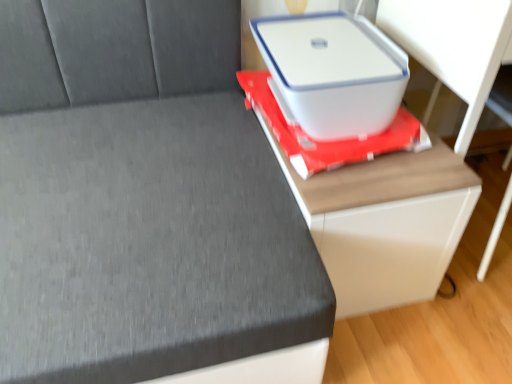
This screenshot has width=512, height=384. I want to click on white plastic storage box at upper right, so click(333, 72).

Does white plastic storage box at upper right have a greater height compared to white glossy table at center?

No.

Between white plastic storage box at upper right and white glossy table at center, which one appears on the right side from the viewer's perspective?

From the viewer's perspective, white glossy table at center appears more on the right side.

Relative to white glossy table at center, is white plastic storage box at upper right in front or behind?

white plastic storage box at upper right is behind white glossy table at center.

From the image's perspective, is white plastic storage box at upper right over white glossy table at center?

Yes, from the image's perspective, white plastic storage box at upper right is above white glossy table at center.

From a real-world perspective, is white glossy table at center under white plastic storage box at upper right?

Yes, from a real-world perspective, white glossy table at center is beneath white plastic storage box at upper right.

Considering the sizes of objects white glossy table at center and white plastic storage box at upper right in the image provided, who is wider, white glossy table at center or white plastic storage box at upper right?

white glossy table at center is wider.

The image size is (512, 384). I want to click on storage box that is above the white glossy table at center (from the image's perspective), so click(333, 72).

Is white glossy table at center inside or outside of white plastic storage box at upper right?

white glossy table at center is located beyond the bounds of white plastic storage box at upper right.

Locate an element on the screen. Image resolution: width=512 pixels, height=384 pixels. table below the white matte computer desk at right (from the image's perspective) is located at coordinates (373, 204).

Looking at this image, which object is thinner, white matte computer desk at right or white glossy table at center?

Thinner between the two is white matte computer desk at right.

From the image's perspective, who appears lower, white matte computer desk at right or white glossy table at center?

white glossy table at center is shown below in the image.

Who is taller, white plastic storage box at upper right or white plastic container at upper right?

With more height is white plastic container at upper right.

Is white plastic storage box at upper right outside of white plastic container at upper right?

Yes, white plastic storage box at upper right is located beyond the bounds of white plastic container at upper right.

Could you tell me if white plastic storage box at upper right is facing white plastic container at upper right?

Yes.

Where is `furniture below the white plastic storage box at upper right (from the image's perspective)`? The width and height of the screenshot is (512, 384). furniture below the white plastic storage box at upper right (from the image's perspective) is located at coordinates (145, 204).

Which is closer, (391, 286) or (377, 15)?

The point (391, 286) is closer to the camera.

From a real-world perspective, which is physically below, white glossy table at center or white matte computer desk at right?

white glossy table at center.

Is white glossy table at center looking in the opposite direction of white matte computer desk at right?

white glossy table at center does not have its back to white matte computer desk at right.

From the image's perspective, is white plastic container at upper right located beneath white glossy table at center?

Yes.

Does white plastic container at upper right lie behind white glossy table at center?

No, white plastic container at upper right is in front of white glossy table at center.

Can you tell me how much white plastic container at upper right and white glossy table at center differ in facing direction?

white plastic container at upper right and white glossy table at center are facing 0.926 degrees away from each other.

Does white plastic container at upper right have a greater height compared to white glossy table at center?

Correct, white plastic container at upper right is much taller as white glossy table at center.

From the image's perspective, who appears lower, white plastic container at upper right or white plastic storage box at upper right?

white plastic container at upper right.

In terms of width, does white plastic container at upper right look wider or thinner when compared to white plastic storage box at upper right?

In the image, white plastic container at upper right appears to be wider than white plastic storage box at upper right.

Is point (50, 72) farther from camera compared to point (304, 19)?

No.

Is white plastic container at upper right at the right side of white plastic storage box at upper right?

No, white plastic container at upper right is not to the right of white plastic storage box at upper right.

Find the location of a particular element. This screenshot has height=384, width=512. storage box above the white glossy table at center (from a real-world perspective) is located at coordinates (333, 72).

At what (x,y) coordinates should I click in order to perform the action: click on table located underneath the white plastic storage box at upper right (from a real-world perspective). Please return your answer as a coordinate pair (x, y). The width and height of the screenshot is (512, 384). Looking at the image, I should click on (373, 204).

Which object lies further to the anchor point white plastic container at upper right, white plastic storage box at upper right or white matte computer desk at right?

white matte computer desk at right.

Based on their spatial positions, is white plastic storage box at upper right or white plastic container at upper right closer to white matte computer desk at right?

white plastic storage box at upper right.

From the image, which object appears to be nearer to white matte computer desk at right, white glossy table at center or white plastic storage box at upper right?

Based on the image, white plastic storage box at upper right appears to be nearer to white matte computer desk at right.

From the picture: When comparing their distances from white glossy table at center, does white plastic container at upper right or white plastic storage box at upper right seem closer?

white plastic storage box at upper right is closer to white glossy table at center.

Looking at the image, which one is located further to white matte computer desk at right, white plastic container at upper right or white glossy table at center?

white plastic container at upper right is further to white matte computer desk at right.

Considering their positions, is white plastic container at upper right positioned further to white plastic storage box at upper right than white matte computer desk at right?

white plastic container at upper right is positioned further to the anchor white plastic storage box at upper right.

From the image, which object appears to be nearer to white plastic container at upper right, white glossy table at center or white plastic storage box at upper right?

Based on the image, white glossy table at center appears to be nearer to white plastic container at upper right.

In the scene shown: When comparing their distances from white plastic storage box at upper right, does white glossy table at center or white matte computer desk at right seem closer?

white glossy table at center is closer to white plastic storage box at upper right.

You are a GUI agent. You are given a task and a screenshot of the screen. Output one action in this format:
    pyautogui.click(x=<x>, y=<y>)
    Task: Click on the table located between white plastic storage box at upper right and white matte computer desk at right in the left-right direction
    The image size is (512, 384).
    Given the screenshot: What is the action you would take?
    click(x=373, y=204)

I want to click on table situated between white plastic container at upper right and white matte computer desk at right from left to right, so click(x=373, y=204).

The image size is (512, 384). Find the location of `table positioned between white plastic container at upper right and white plastic storage box at upper right from near to far`. table positioned between white plastic container at upper right and white plastic storage box at upper right from near to far is located at coordinates (373, 204).

The image size is (512, 384). What are the coordinates of `storage box between white plastic container at upper right and white matte computer desk at right in the horizontal direction` in the screenshot? It's located at (333, 72).